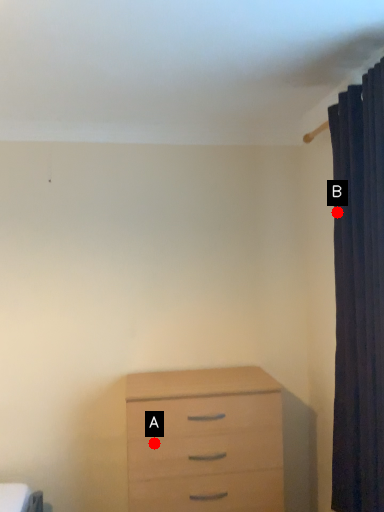
Question: Two points are circled on the image, labeled by A and B beside each circle. Among these points, which one is farthest from the camera?

Choices:
 (A) A is further
 (B) B is further

Answer: (A)